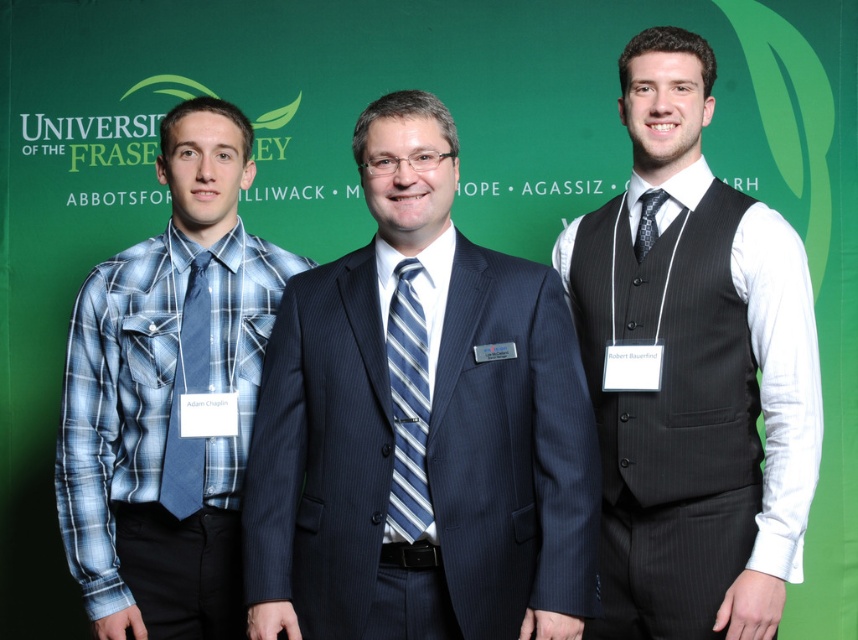
Question: Estimate the real-world distances between objects in this image. Which object is farther from the blue striped tie at center?

Choices:
 (A) black pinstripe vest at center
 (B) dark blue pinstripe suit at center

Answer: (A)

Question: Is black pinstripe vest at center to the right of blue plaid tie at left from the viewer's perspective?

Choices:
 (A) no
 (B) yes

Answer: (B)

Question: Which of the following is the farthest from the observer?

Choices:
 (A) black textured tie at right
 (B) dark blue pinstripe suit at center
 (C) black pinstripe vest at center
 (D) blue plaid shirt at left

Answer: (A)

Question: Does black pinstripe vest at center appear on the right side of blue plaid shirt at left?

Choices:
 (A) no
 (B) yes

Answer: (B)

Question: Does dark blue pinstripe suit at center have a greater width compared to blue striped tie at center?

Choices:
 (A) no
 (B) yes

Answer: (B)

Question: Which point appears closest to the camera in this image?

Choices:
 (A) (180, 513)
 (B) (645, 204)
 (C) (222, 115)

Answer: (A)